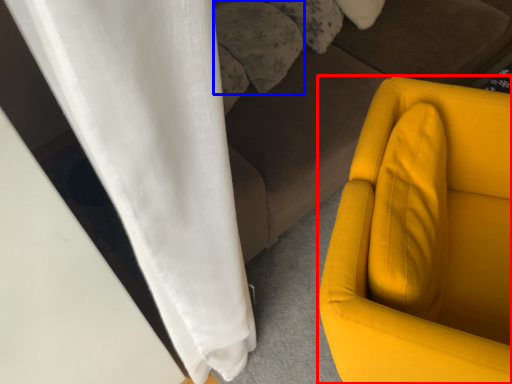
Question: Among these objects, which one is farthest to the camera, furniture (highlighted by a red box) or pillow (highlighted by a blue box)?

Choices:
 (A) furniture
 (B) pillow

Answer: (B)